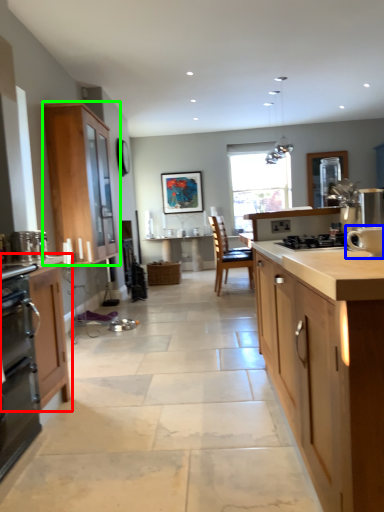
Question: Based on their relative distances, which object is nearer to cabinetry (highlighted by a red box)? Choose from appliance (highlighted by a blue box) and cabinetry (highlighted by a green box).

Choices:
 (A) appliance
 (B) cabinetry

Answer: (A)